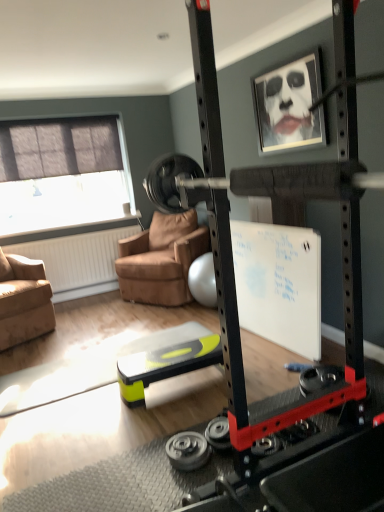
Question: From a real-world perspective, is black rubber weight at lower center, which is the 1th wheel in bottom-to-top order, physically below matte gray window at upper left?

Choices:
 (A) yes
 (B) no

Answer: (A)

Question: Can you confirm if black rubber weight at lower center, which is the 1th wheel in bottom-to-top order, is shorter than matte gray window at upper left?

Choices:
 (A) no
 (B) yes

Answer: (B)

Question: Considering the relative sizes of black rubber weight at lower center, which is the 1th wheel in bottom-to-top order, and matte gray window at upper left in the image provided, is black rubber weight at lower center, which is the 1th wheel in bottom-to-top order, wider than matte gray window at upper left?

Choices:
 (A) no
 (B) yes

Answer: (B)

Question: Is black rubber weight at lower center, which is the 1th wheel in bottom-to-top order, bigger than matte gray window at upper left?

Choices:
 (A) no
 (B) yes

Answer: (A)

Question: From the image's perspective, is black rubber weight at lower center, the 2th wheel from the top, located above matte gray window at upper left?

Choices:
 (A) no
 (B) yes

Answer: (A)

Question: From the image's perspective, is black rubber weight at lower center, which is the 1th wheel in bottom-to-top order, above or below brown leather chair at center, marked as the second chair in a left-to-right arrangement?

Choices:
 (A) above
 (B) below

Answer: (B)

Question: Looking at their shapes, would you say black rubber weight at lower center, which is the 1th wheel in bottom-to-top order, is wider or thinner than brown leather chair at center, marked as the second chair in a left-to-right arrangement?

Choices:
 (A) thin
 (B) wide

Answer: (A)

Question: From a real-world perspective, is black rubber weight at lower center, which is the 1th wheel in bottom-to-top order, physically located above or below brown leather chair at center, marked as the second chair in a left-to-right arrangement?

Choices:
 (A) below
 (B) above

Answer: (A)

Question: In terms of size, does black rubber weight at lower center, the 2th wheel from the top, appear bigger or smaller than brown leather chair at center, the 1th chair viewed from the right?

Choices:
 (A) small
 (B) big

Answer: (A)

Question: Considering the positions of matte black picture frame at upper center and matte gray window at upper left in the image, is matte black picture frame at upper center bigger or smaller than matte gray window at upper left?

Choices:
 (A) big
 (B) small

Answer: (B)

Question: Based on their positions, is matte black picture frame at upper center located to the left or right of matte gray window at upper left?

Choices:
 (A) right
 (B) left

Answer: (A)

Question: In terms of width, does matte black picture frame at upper center look wider or thinner when compared to matte gray window at upper left?

Choices:
 (A) thin
 (B) wide

Answer: (B)

Question: From their relative heights in the image, would you say matte black picture frame at upper center is taller or shorter than matte gray window at upper left?

Choices:
 (A) tall
 (B) short

Answer: (B)

Question: Is brown leather chair at center, marked as the second chair in a left-to-right arrangement, wider or thinner than black rubber weight at lower center, which is the 1th wheel in bottom-to-top order?

Choices:
 (A) thin
 (B) wide

Answer: (B)

Question: In the image, is brown leather chair at center, the 1th chair viewed from the right, positioned in front of or behind black rubber weight at lower center, the 2th wheel from the top?

Choices:
 (A) behind
 (B) front

Answer: (A)